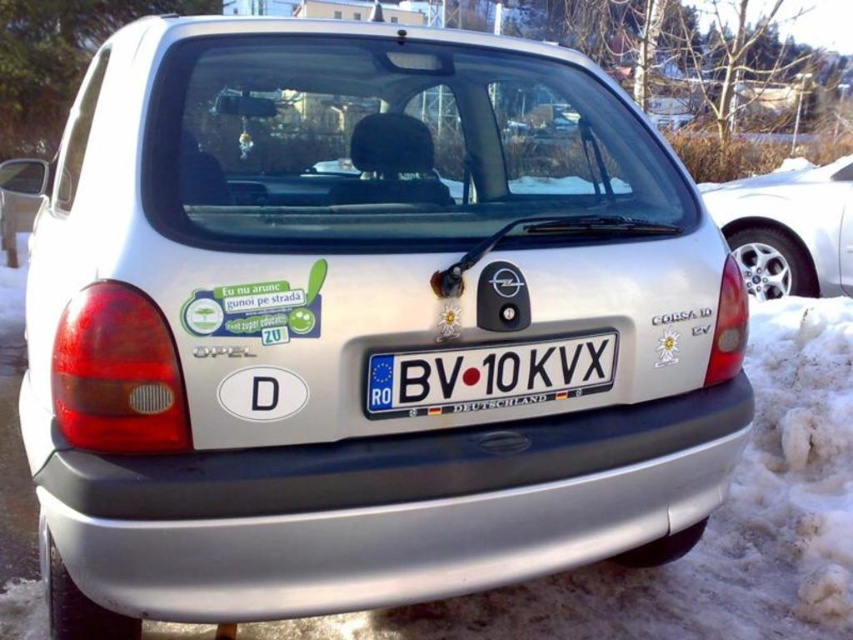
You are a delivery driver who needs to park your white glossy car at right next to the black rubber bumper at center. The parking space is only 4 meters long. Will there be enough space to park without overlapping?

The black rubber bumper at center is 3.63 meters away from the white glossy car at right. Since the parking space is 4 meters long, there will be enough space to park the white glossy car at right next to the black rubber bumper at center without overlapping.

You are a parking attendant and need to direct a car to park behind the blue metallic license plate at center without blocking the white glossy car at right. Is this possible given their positions?

The white glossy car at right is above the blue metallic license plate at center, so directing the car to park behind the blue metallic license plate at center would not block the white glossy car at right since it is positioned lower.

You are a traffic officer checking the rear of the silver Opel Corsa 10 parked in the snow. You notice the blue metallic license plate at center and the satin silver car at left. Which object is located lower in the image?

The blue metallic license plate at center is positioned under the satin silver car at left, so it is located lower in the image.